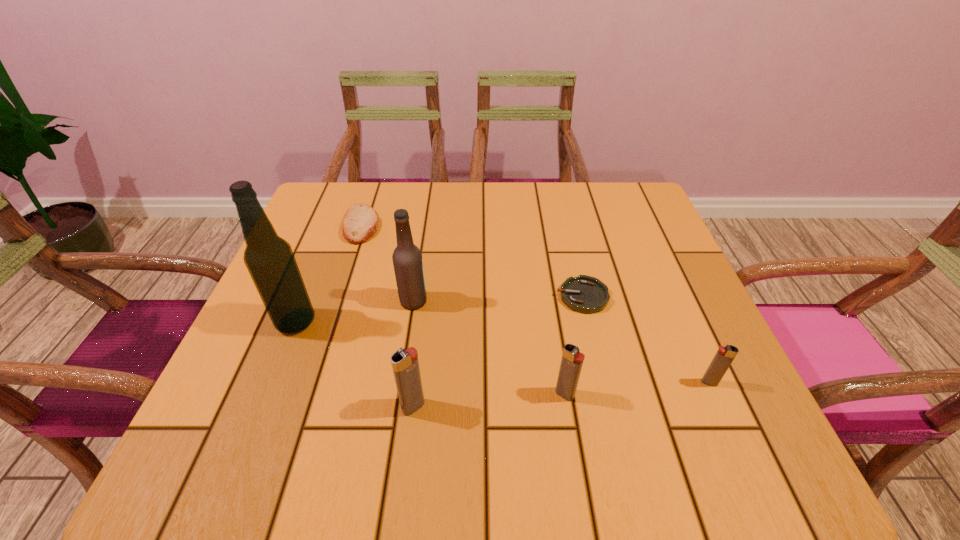
Find the location of a particular element. Image resolution: width=960 pixels, height=540 pixels. ashtray is located at coordinates (585, 294).

You are a GUI agent. You are given a task and a screenshot of the screen. Output one action in this format:
    pyautogui.click(x=<x>, y=<y>)
    Task: Click on the alcohol
    This screenshot has height=540, width=960.
    Given the screenshot: What is the action you would take?
    pyautogui.click(x=269, y=258)

Find the location of a particular element. The width and height of the screenshot is (960, 540). blank area located on the right of the tallest igniter is located at coordinates (583, 407).

Where is `free space located 0.350m on the left of the fourth tallest object`? free space located 0.350m on the left of the fourth tallest object is located at coordinates (355, 394).

Locate an element on the screen. This screenshot has height=540, width=960. vacant space situated 0.060m on the front of the shortest igniter is located at coordinates (725, 417).

At what (x,y) coordinates should I click in order to perform the action: click on blank space located 0.340m on the right of the pita bread. Please return your answer as a coordinate pair (x, y). Looking at the image, I should click on (512, 225).

Locate an element on the screen. This screenshot has width=960, height=540. vacant space located on the side of the second tallest object with the label is located at coordinates (455, 301).

This screenshot has height=540, width=960. What are the coordinates of `vacant space located 0.390m on the back of the shortest object` in the screenshot? It's located at (557, 187).

At what (x,y) coordinates should I click in order to perform the action: click on blank space located 0.110m on the back of the alcohol. Please return your answer as a coordinate pair (x, y). The height and width of the screenshot is (540, 960). Looking at the image, I should click on (316, 272).

This screenshot has width=960, height=540. Find the location of `object that is at the far edge`. object that is at the far edge is located at coordinates pos(361,222).